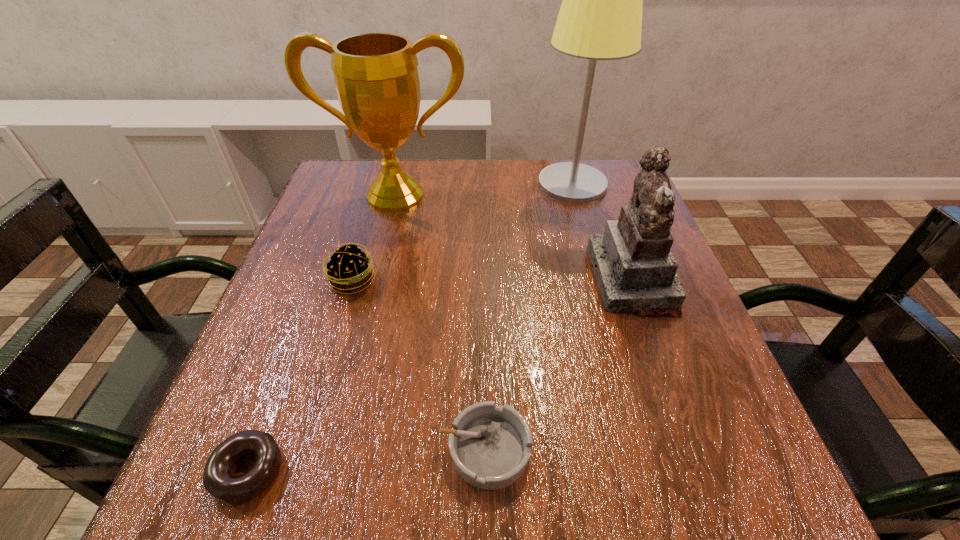
Locate an element on the screen. This screenshot has height=540, width=960. free region at the far left corner of the desktop is located at coordinates (356, 160).

The height and width of the screenshot is (540, 960). I want to click on empty location between the tallest object and the doughnut, so click(411, 328).

I want to click on empty space that is in between the second tallest object and the ashtray, so click(x=441, y=322).

Identify the location of empty location between the doughnut and the third shortest object. The image size is (960, 540). (300, 375).

Where is `vacant point located between the award and the doughnut`? The width and height of the screenshot is (960, 540). vacant point located between the award and the doughnut is located at coordinates (322, 333).

The height and width of the screenshot is (540, 960). Find the location of `vacant area that lies between the table lamp and the fourth shortest object`. vacant area that lies between the table lamp and the fourth shortest object is located at coordinates (602, 232).

Identify the location of free space that is in between the tallest object and the doughnut. The width and height of the screenshot is (960, 540). (411, 328).

You are a GUI agent. You are given a task and a screenshot of the screen. Output one action in this format:
    pyautogui.click(x=<x>, y=<y>)
    Task: Click on the free space between the ashtray and the figurine
    This screenshot has width=960, height=540.
    Given the screenshot: What is the action you would take?
    pyautogui.click(x=559, y=364)

Find the location of `vacant area that lies between the doughnut and the fourth tallest object`. vacant area that lies between the doughnut and the fourth tallest object is located at coordinates (300, 375).

Locate an element on the screen. unoccupied position between the ashtray and the tallest object is located at coordinates (529, 317).